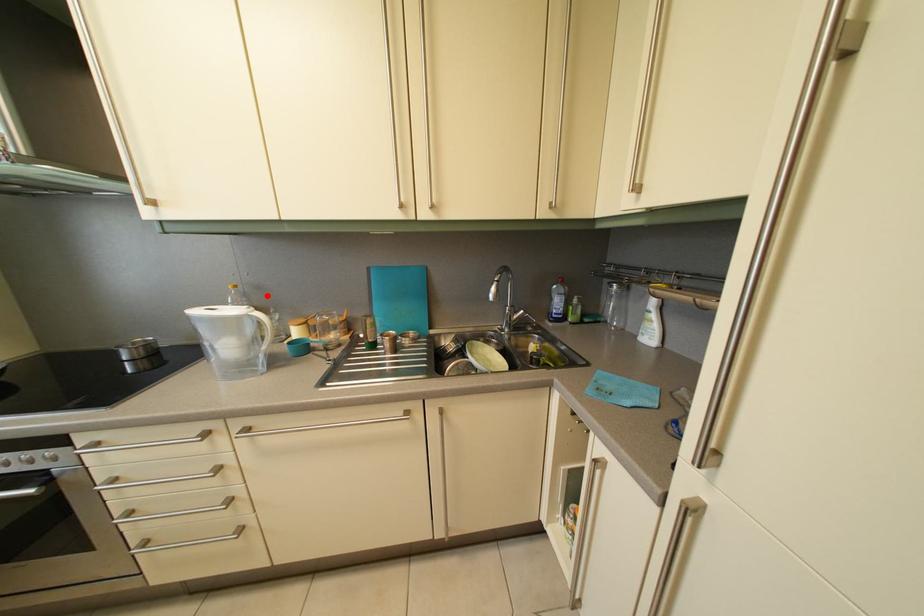
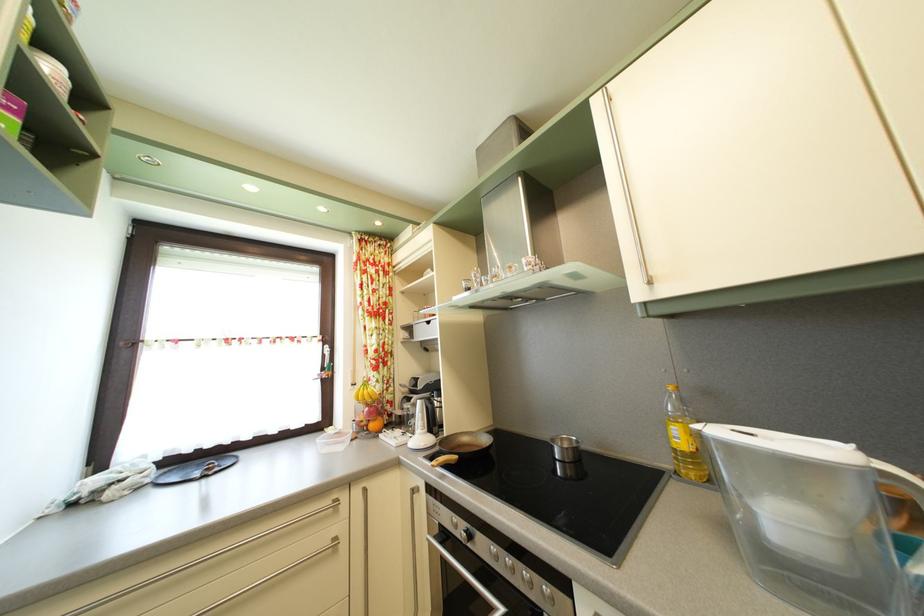
Question: I am providing you with two images of the same scene from different viewpoints. Image1 has a red point marked. In image2, the corresponding 3D location appears at what relative position? Reply with the corresponding letter.

Choices:
 (A) Closer
 (B) Farther

Answer: (B)